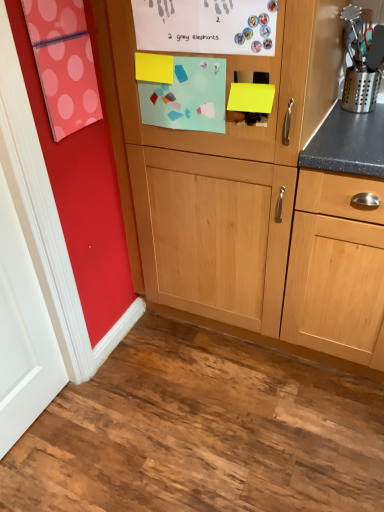
Question: Is wooden cabinet at center wider or thinner than white matte door at left?

Choices:
 (A) wide
 (B) thin

Answer: (A)

Question: Visually, is wooden cabinet at center positioned to the left or to the right of white matte door at left?

Choices:
 (A) left
 (B) right

Answer: (B)

Question: Considering the positions of wooden cabinet at center and white matte door at left in the image, is wooden cabinet at center bigger or smaller than white matte door at left?

Choices:
 (A) big
 (B) small

Answer: (A)

Question: In terms of width, does white matte door at left look wider or thinner when compared to wooden cabinet at center?

Choices:
 (A) wide
 (B) thin

Answer: (B)

Question: Is point (4, 196) positioned closer to the camera than point (231, 261)?

Choices:
 (A) closer
 (B) farther

Answer: (A)

Question: In the image, is white matte door at left positioned in front of or behind wooden cabinet at center?

Choices:
 (A) front
 (B) behind

Answer: (A)

Question: From the image's perspective, is white matte door at left located above or below wooden cabinet at center?

Choices:
 (A) above
 (B) below

Answer: (B)